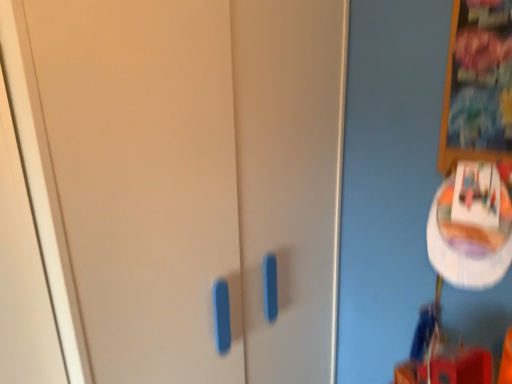
This screenshot has width=512, height=384. Identify the location of matte plastic door at center. (197, 178).

Describe the element at coordinates (197, 178) in the screenshot. I see `matte plastic door at center` at that location.

Locate an element on the screen. This screenshot has height=384, width=512. matte plastic door at center is located at coordinates (197, 178).